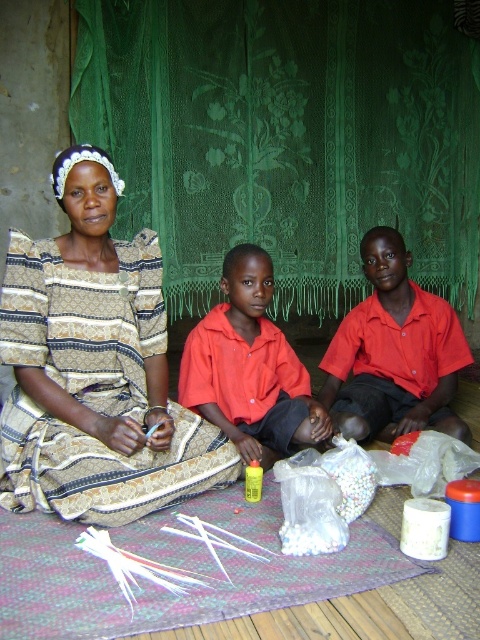
Who is more distant from viewer, (27, 483) or (202, 360)?

The point (202, 360) is behind.

Is patterned fabric dress at left to the left of red matte shirt at center from the viewer's perspective?

Indeed, patterned fabric dress at left is positioned on the left side of red matte shirt at center.

Is point (95, 428) behind point (283, 433)?

No, it is in front of (283, 433).

Where is `patterned fabric dress at left`? The width and height of the screenshot is (480, 640). patterned fabric dress at left is located at coordinates (95, 368).

Between patterned fabric dress at left and matte red shirt at center, which one has less height?

Standing shorter between the two is matte red shirt at center.

Is patterned fabric dress at left smaller than matte red shirt at center?

No.

Who is more distant from viewer, (83,282) or (385,406)?

The point (385,406) is behind.

Identify the location of patterned fabric dress at left. The image size is (480, 640). (95, 368).

Is matte red shirt at center smaller than red matte shirt at center?

Incorrect, matte red shirt at center is not smaller in size than red matte shirt at center.

Does matte red shirt at center have a greater height compared to red matte shirt at center?

Yes, matte red shirt at center is taller than red matte shirt at center.

At what (x,y) coordinates should I click in order to perform the action: click on matte red shirt at center. Please return your answer as a coordinate pair (x, y). This screenshot has height=640, width=480. Looking at the image, I should click on (394, 353).